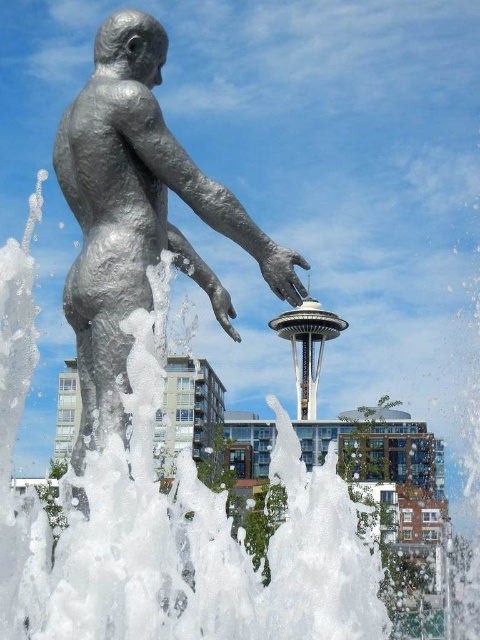
Question: Does shiny silver statue at center appear under white metallic tower at center?

Choices:
 (A) yes
 (B) no

Answer: (B)

Question: Is shiny silver statue at center to the left of white metallic tower at center from the viewer's perspective?

Choices:
 (A) yes
 (B) no

Answer: (A)

Question: Which point is farther to the camera?

Choices:
 (A) shiny silver statue at center
 (B) white metallic tower at center

Answer: (B)

Question: Is shiny silver statue at center wider than white metallic tower at center?

Choices:
 (A) no
 (B) yes

Answer: (A)

Question: Which of the following is the closest to the observer?

Choices:
 (A) white metallic tower at center
 (B) shiny silver statue at center

Answer: (B)

Question: Which object is farther from the camera taking this photo?

Choices:
 (A) white metallic tower at center
 (B) shiny silver statue at center

Answer: (A)